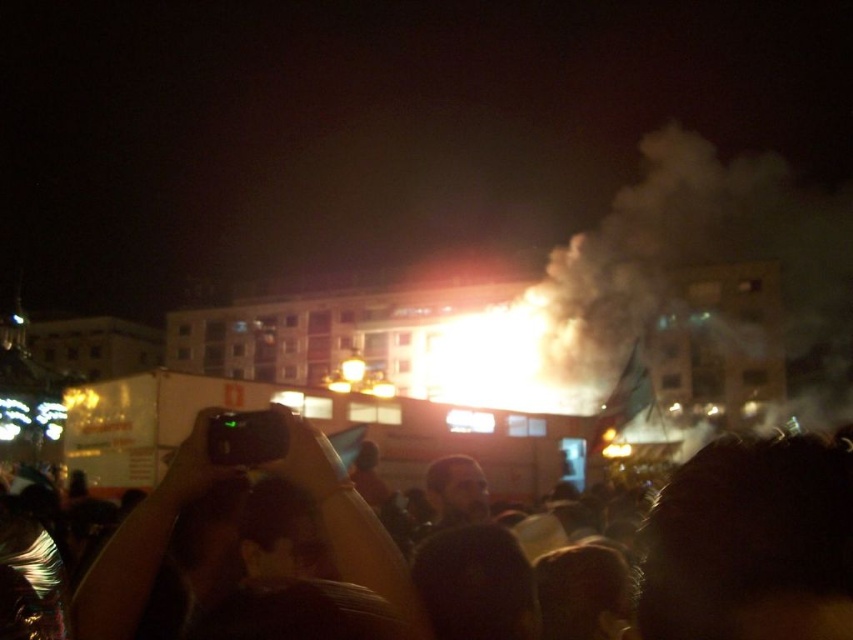
You are a photographer trying to take a photo of the building on fire. You have a matte black camera at center and there is a black matte crowd at center in front of you. Can you see the building through the crowd with your camera?

The black matte crowd at center has a greater height compared to matte black camera at center, so the crowd will block your view of the building.

You are a photographer trying to capture the scene of the building in distress. You have a camera with a zoom lens that can focus on specific coordinates. The coordinates you need to focus on are point (751, 544). According to the image, what object or area will be in focus at those coordinates?

The point (751, 544) is on the black matte crowd at center, so focusing there will center the camera on the crowd in the middle of the scene.